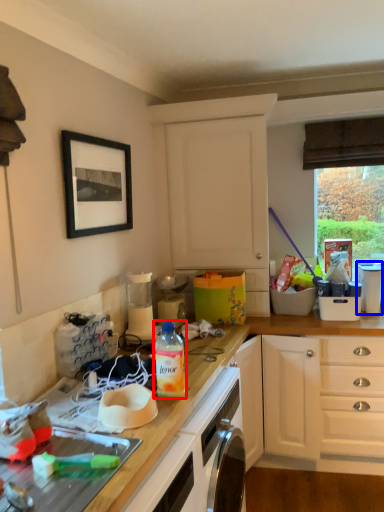
Question: Which of the following is the farthest to the observer, bottle (highlighted by a red box) or appliance (highlighted by a blue box)?

Choices:
 (A) bottle
 (B) appliance

Answer: (B)